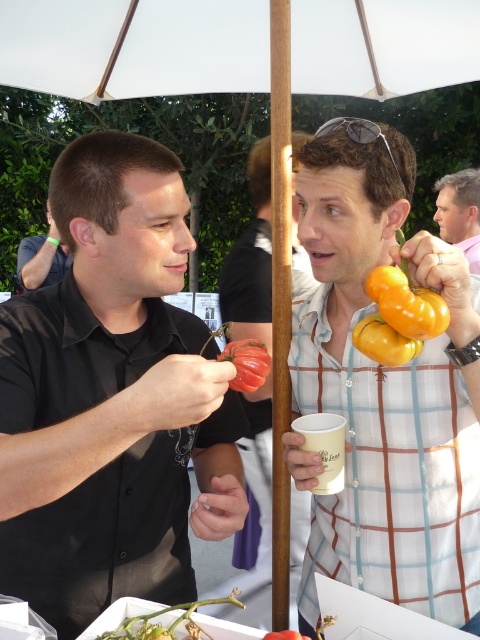
Between matte orange squash at center and yellow matte bell pepper at upper right, which one is positioned lower?

matte orange squash at center is lower down.

Can you confirm if matte orange squash at center is positioned above yellow matte bell pepper at upper right?

No, matte orange squash at center is not above yellow matte bell pepper at upper right.

This screenshot has width=480, height=640. I want to click on matte orange squash at center, so click(256, 509).

Where is `matte orange squash at center`? matte orange squash at center is located at coordinates (256, 509).

Based on the photo, can you confirm if matte orange squash at center is thinner than matte white shirt at upper right?

No.

Image resolution: width=480 pixels, height=640 pixels. I want to click on matte orange squash at center, so click(x=256, y=509).

Is point (188, 636) closer to viewer compared to point (233, 381)?

Yes, it is.

Which is behind, point (144, 621) or point (233, 346)?

The point (233, 346) is more distant.

Locate an element on the screen. green matte vegetable at lower left is located at coordinates (168, 624).